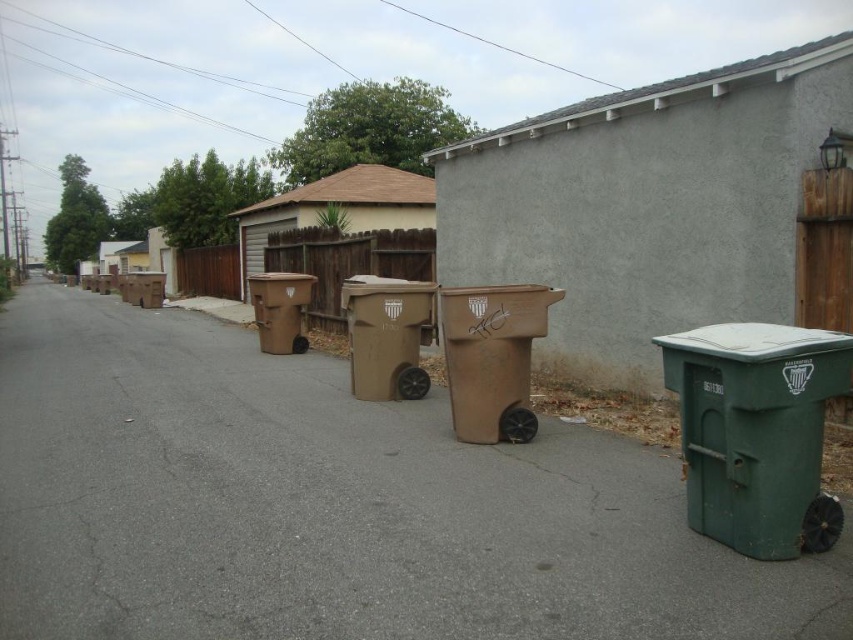
You are standing on the residential street and see the point marked at coordinates [334,506]. What object is located at that point?

The point at coordinates [334,506] corresponds to the brown plastic trash can at center.

You are a waste collector who needs to load the brown matte trash can at center and the brown cardboard bin at center onto your truck. Based on their positions, which one should you load first to maintain the order they are in on the street?

The brown cardboard bin at center should be loaded first because the brown matte trash can at center is positioned on the right side of it, so the cardboard bin is on the left and closer to the truck if approaching from the front.